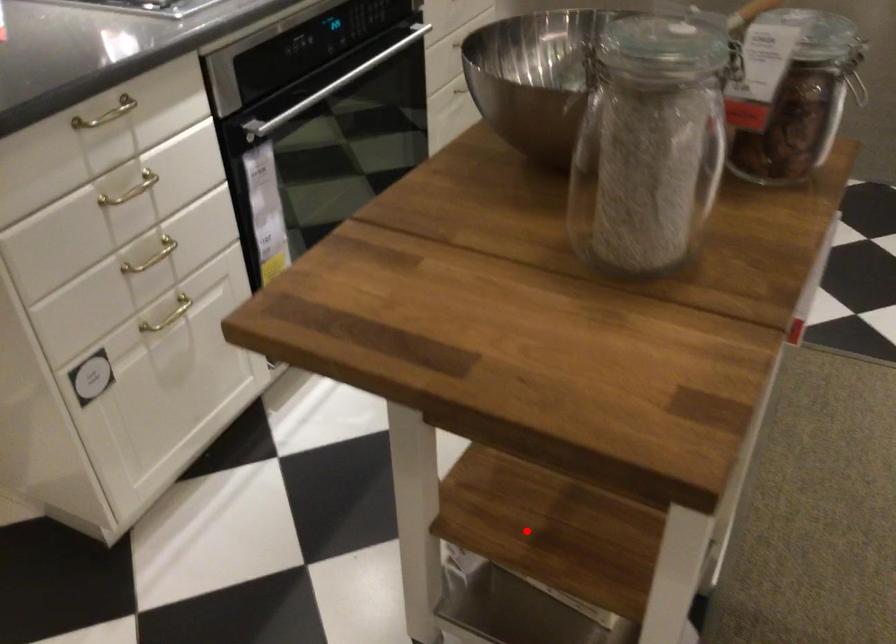
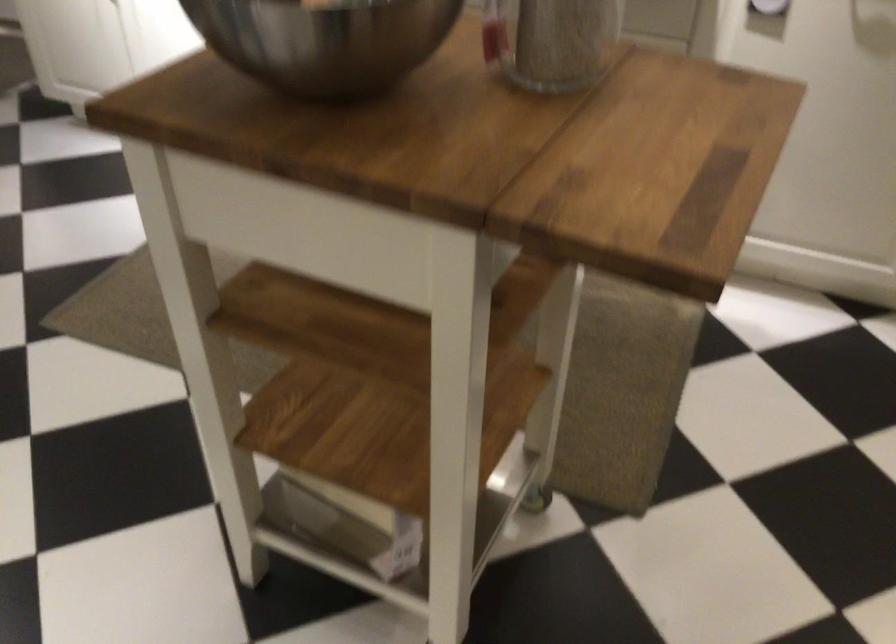
Question: I am providing you with two images of the same scene from different viewpoints. Image1 has a red point marked. In image2, the corresponding 3D location appears at what relative position? Reply with the corresponding letter.

Choices:
 (A) Closer
 (B) Farther

Answer: (B)